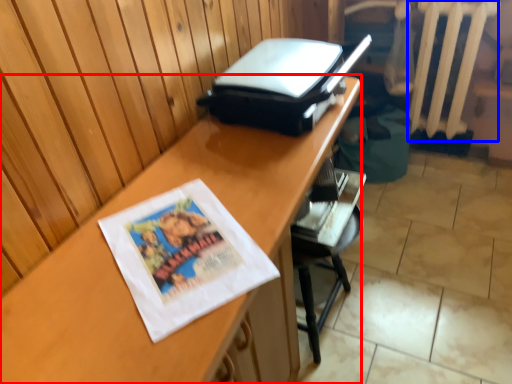
Question: Which of the following is the closest to the observer, desk (highlighted by a red box) or radiator (highlighted by a blue box)?

Choices:
 (A) desk
 (B) radiator

Answer: (A)